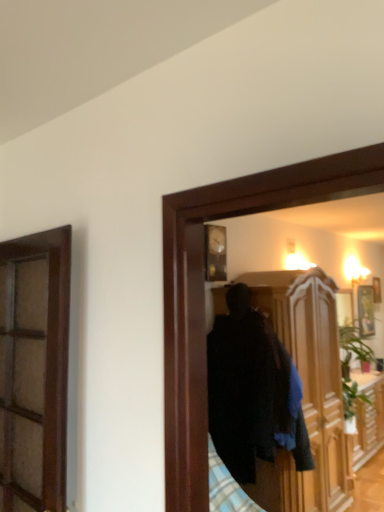
Describe the element at coordinates (366, 311) in the screenshot. I see `gold metallic picture frame at upper right` at that location.

Where is `gold metallic picture frame at upper right`? The height and width of the screenshot is (512, 384). gold metallic picture frame at upper right is located at coordinates (366, 311).

In the scene shown: What is the approximate height of gold metallic picture frame at upper right?

gold metallic picture frame at upper right is 33.39 inches tall.

What is the approximate width of gold metallic picture frame at upper right?

The width of gold metallic picture frame at upper right is 5.09 inches.

The height and width of the screenshot is (512, 384). In order to click on wooden cabinet at center in this screenshot , I will do `click(305, 390)`.

What do you see at coordinates (305, 390) in the screenshot?
I see `wooden cabinet at center` at bounding box center [305, 390].

Measure the distance between point [300,473] and camera.

They are 9.79 feet apart.

I want to click on gold metallic picture frame at upper right, so click(366, 311).

Between wooden cabinet at center and gold metallic picture frame at upper right, which one appears on the right side from the viewer's perspective?

gold metallic picture frame at upper right is more to the right.

Is wooden cabinet at center in front of or behind gold metallic picture frame at upper right in the image?

Visually, wooden cabinet at center is located in front of gold metallic picture frame at upper right.

Does point (321, 506) come behind point (369, 291)?

No, (321, 506) is in front of (369, 291).

From the image's perspective, which one is positioned lower, wooden cabinet at center or gold metallic picture frame at upper right?

wooden cabinet at center appears lower in the image.

From a real-world perspective, is wooden cabinet at center below gold metallic picture frame at upper right?

Correct, in the physical world, wooden cabinet at center is lower than gold metallic picture frame at upper right.

Considering the relative sizes of wooden cabinet at center and gold metallic picture frame at upper right in the image provided, is wooden cabinet at center wider than gold metallic picture frame at upper right?

Yes.

Between wooden cabinet at center and gold metallic picture frame at upper right, which one has more height?

wooden cabinet at center is taller.

Can you confirm if wooden cabinet at center is bigger than gold metallic picture frame at upper right?

Yes.

Can we say wooden cabinet at center lies outside gold metallic picture frame at upper right?

Yes, wooden cabinet at center is located beyond the bounds of gold metallic picture frame at upper right.

Does wooden cabinet at center touch gold metallic picture frame at upper right?

wooden cabinet at center is not next to gold metallic picture frame at upper right, and they're not touching.

Is wooden cabinet at center facing away from gold metallic picture frame at upper right?

wooden cabinet at center is not turned away from gold metallic picture frame at upper right.

How many degrees apart are the facing directions of wooden cabinet at center and gold metallic picture frame at upper right?

4.27 degrees.

Where is `cabinetry below the gold metallic picture frame at upper right (from the image's perspective)`? The height and width of the screenshot is (512, 384). cabinetry below the gold metallic picture frame at upper right (from the image's perspective) is located at coordinates (305, 390).

Considering the relative positions of gold metallic picture frame at upper right and wooden cabinet at center in the image provided, is gold metallic picture frame at upper right to the left of wooden cabinet at center from the viewer's perspective?

In fact, gold metallic picture frame at upper right is to the right of wooden cabinet at center.

Is the depth of gold metallic picture frame at upper right less than that of wooden cabinet at center?

No, gold metallic picture frame at upper right is behind wooden cabinet at center.

Which is more distant, (372, 319) or (268, 473)?

The point (372, 319) is farther from the camera.

From the image's perspective, is gold metallic picture frame at upper right above or below wooden cabinet at center?

Clearly, from the image's perspective, gold metallic picture frame at upper right is above wooden cabinet at center.

From a real-world perspective, which object rests below the other?

From a 3D spatial view, wooden cabinet at center is below.

Does gold metallic picture frame at upper right have a lesser width compared to wooden cabinet at center?

Yes, gold metallic picture frame at upper right is thinner than wooden cabinet at center.

Is gold metallic picture frame at upper right taller or shorter than wooden cabinet at center?

Clearly, gold metallic picture frame at upper right is shorter compared to wooden cabinet at center.

Based on the photo, considering the sizes of objects gold metallic picture frame at upper right and wooden cabinet at center in the image provided, who is smaller, gold metallic picture frame at upper right or wooden cabinet at center?

gold metallic picture frame at upper right is smaller.

Is wooden cabinet at center a part of gold metallic picture frame at upper right?

No.

Is there a large distance between gold metallic picture frame at upper right and wooden cabinet at center?

No, gold metallic picture frame at upper right is not far from wooden cabinet at center.

Based on the photo, does gold metallic picture frame at upper right turn towards wooden cabinet at center?

No, gold metallic picture frame at upper right is not turned towards wooden cabinet at center.

Measure the distance between gold metallic picture frame at upper right and wooden cabinet at center.

They are 37.12 inches apart.

Find the location of a particular element. The height and width of the screenshot is (512, 384). picture frame above the wooden cabinet at center (from the image's perspective) is located at coordinates pyautogui.click(x=366, y=311).

Identify the location of picture frame above the wooden cabinet at center (from a real-world perspective). Image resolution: width=384 pixels, height=512 pixels. (366, 311).

Locate an element on the screen. The height and width of the screenshot is (512, 384). cabinetry below the gold metallic picture frame at upper right (from the image's perspective) is located at coordinates (305, 390).